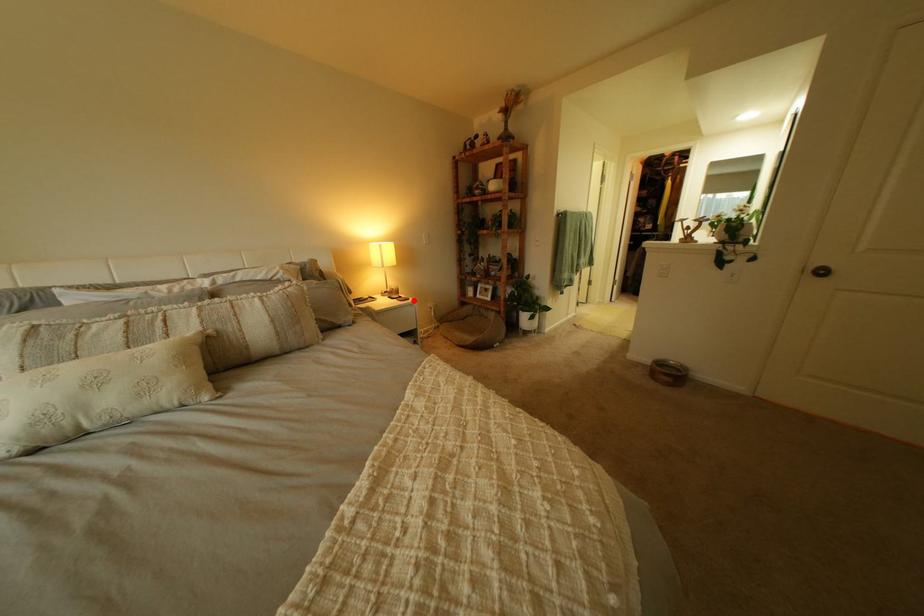
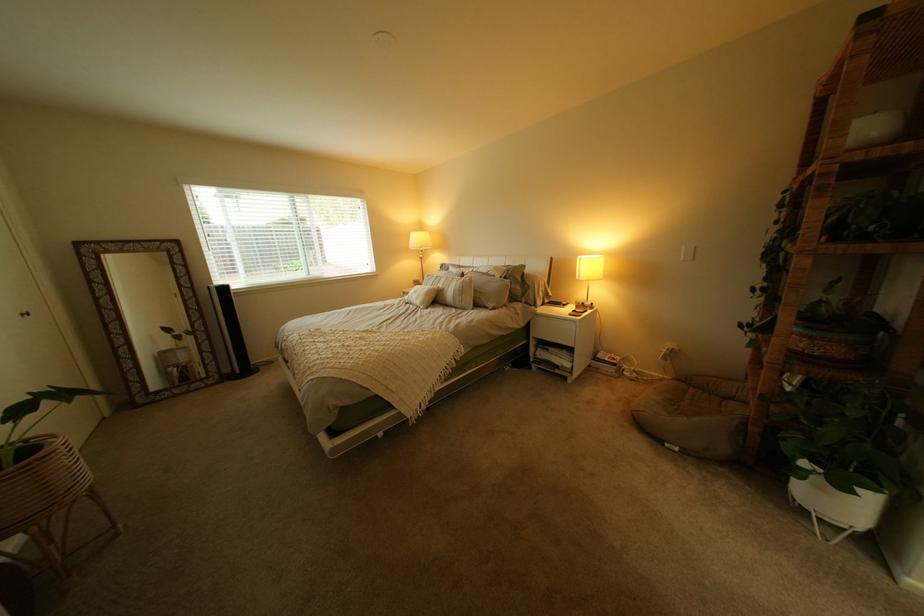
Locate, in the second image, the point that corresponds to the highlighted location in the first image.

(590, 314)